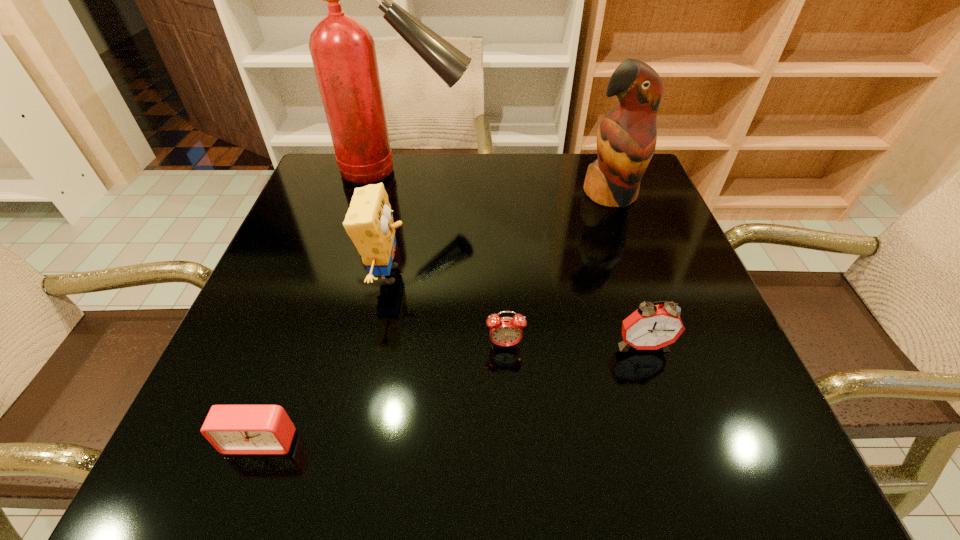
Locate an element on the screen. vacant space located 0.270m on the face of the second tallest object is located at coordinates (647, 298).

Locate an element on the screen. The height and width of the screenshot is (540, 960). vacant space situated 0.260m on the face of the fourth nearest object is located at coordinates (538, 275).

Image resolution: width=960 pixels, height=540 pixels. I want to click on free location located 0.140m on the clock face of the third shortest object, so click(x=671, y=432).

Image resolution: width=960 pixels, height=540 pixels. What are the coordinates of `blank area located 0.190m on the face of the fourth object from left to right` in the screenshot? It's located at (511, 460).

Find the location of a particular element. The width and height of the screenshot is (960, 540). fire extinguisher that is positioned at the far edge is located at coordinates (343, 53).

Locate an element on the screen. parrot at the far edge is located at coordinates (626, 138).

You are a GUI agent. You are given a task and a screenshot of the screen. Output one action in this format:
    pyautogui.click(x=<x>, y=<y>)
    Task: Click on the object located in the near edge section of the desktop
    This screenshot has width=960, height=540.
    Given the screenshot: What is the action you would take?
    pyautogui.click(x=232, y=429)

Where is `fire extinguisher present at the left edge`? This screenshot has width=960, height=540. fire extinguisher present at the left edge is located at coordinates (343, 53).

The image size is (960, 540). In order to click on alarm clock at the left edge in this screenshot , I will do `click(232, 429)`.

Locate an element on the screen. parrot that is at the right edge is located at coordinates (626, 138).